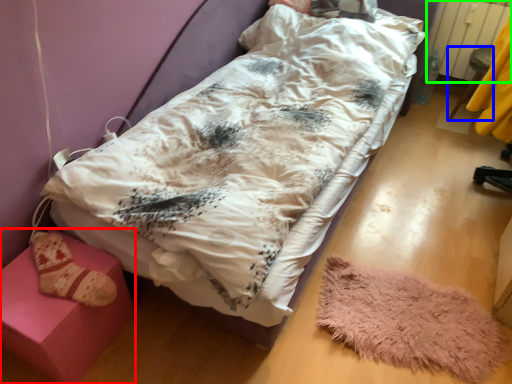
Question: Estimate the real-world distances between objects in this image. Which object is closer to furniture (highlighted by a red box), furniture (highlighted by a blue box) or radiator (highlighted by a green box)?

Choices:
 (A) furniture
 (B) radiator

Answer: (A)